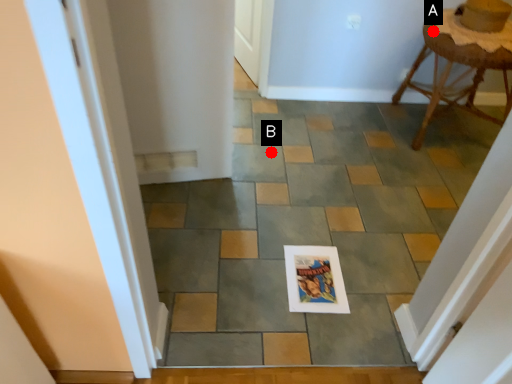
Question: Two points are circled on the image, labeled by A and B beside each circle. Among these points, which one is nearest to the camera?

Choices:
 (A) A is closer
 (B) B is closer

Answer: (A)